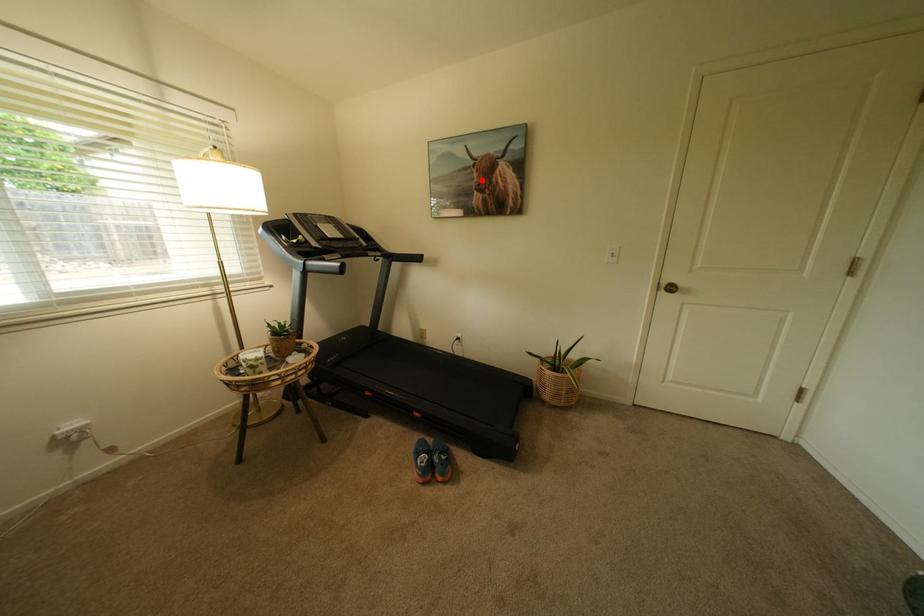
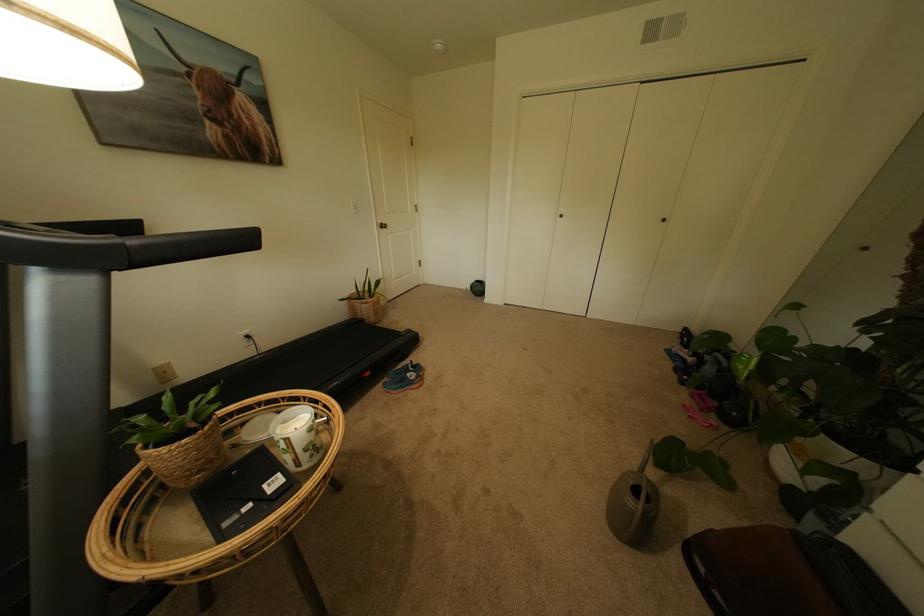
Question: I am providing you with two images of the same scene from different viewpoints. In image1, a red point is highlighted. Considering the same 3D point in image2, which of the following is correct?

Choices:
 (A) It is closer
 (B) It is farther

Answer: (B)